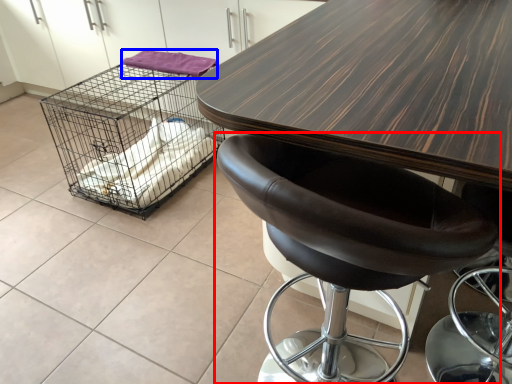
Question: Which object appears closest to the camera in this image, chair (highlighted by a red box) or material (highlighted by a blue box)?

Choices:
 (A) chair
 (B) material

Answer: (A)